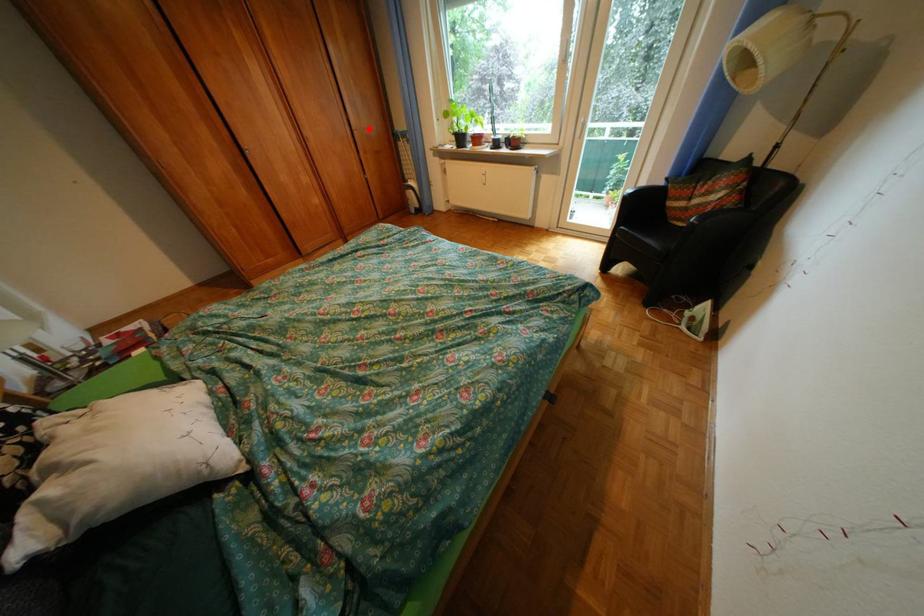
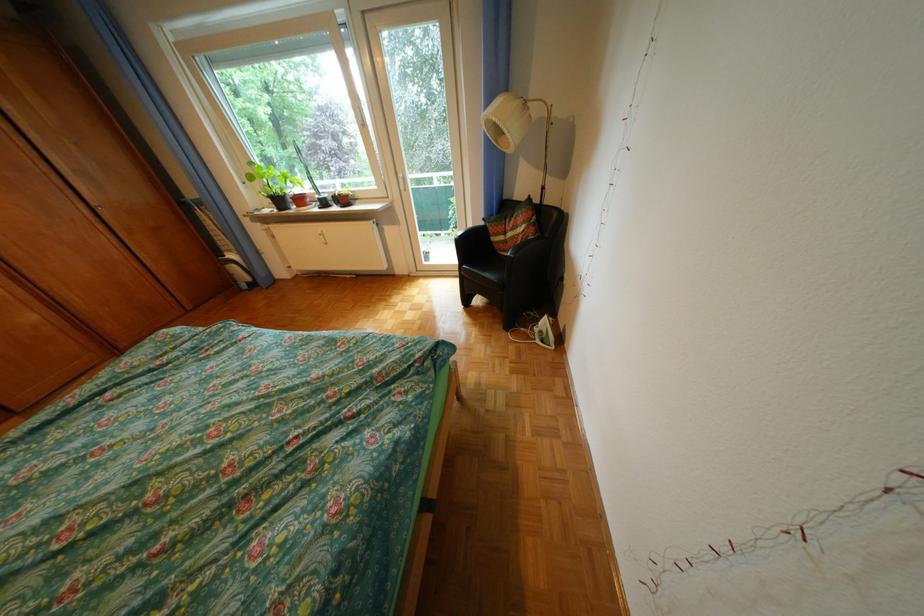
Question: I am providing you with two images of the same scene from different viewpoints. A red point is shown in image1. For the corresponding object point in image2, is it positioned nearer or farther from the camera?

Choices:
 (A) Nearer
 (B) Farther

Answer: (B)